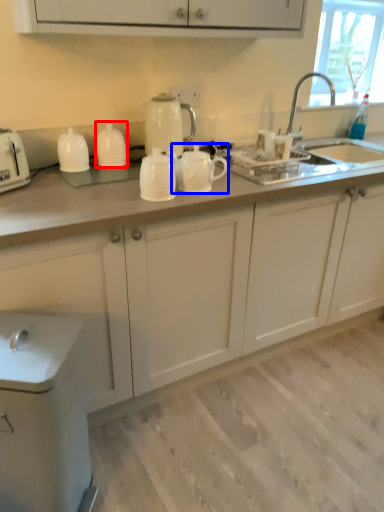
Question: Which object is further to the camera taking this photo, tableware (highlighted by a red box) or tea pot (highlighted by a blue box)?

Choices:
 (A) tableware
 (B) tea pot

Answer: (A)